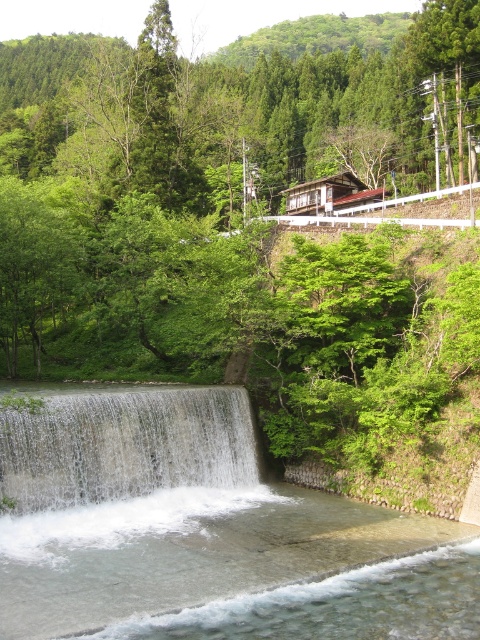
Question: Does clear water at center appear over white frothy water at center?

Choices:
 (A) no
 (B) yes

Answer: (A)

Question: Which object appears closest to the camera in this image?

Choices:
 (A) clear water at center
 (B) white frothy water at center

Answer: (A)

Question: Which point is farther from the camera taking this photo?

Choices:
 (A) [x=325, y=518]
 (B) [x=29, y=456]

Answer: (A)

Question: Is clear water at center above white frothy water at center?

Choices:
 (A) no
 (B) yes

Answer: (A)

Question: Can you confirm if clear water at center is bigger than white frothy water at center?

Choices:
 (A) yes
 (B) no

Answer: (A)